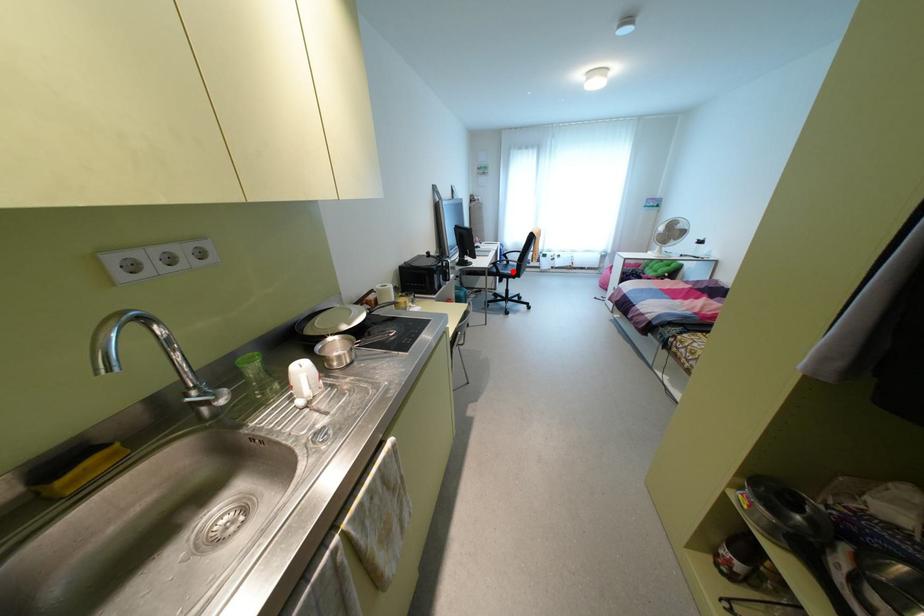
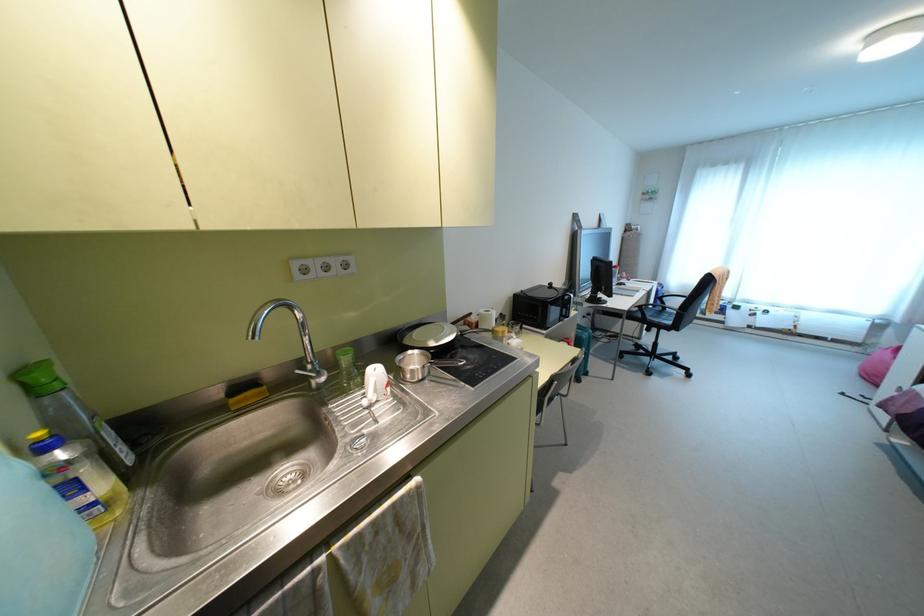
Question: I am providing you with two images of the same scene from different viewpoints. Given a red point in image1, look at the same physical point in image2. Is it:

Choices:
 (A) Closer to the viewpoint
 (B) Farther from the viewpoint

Answer: (A)